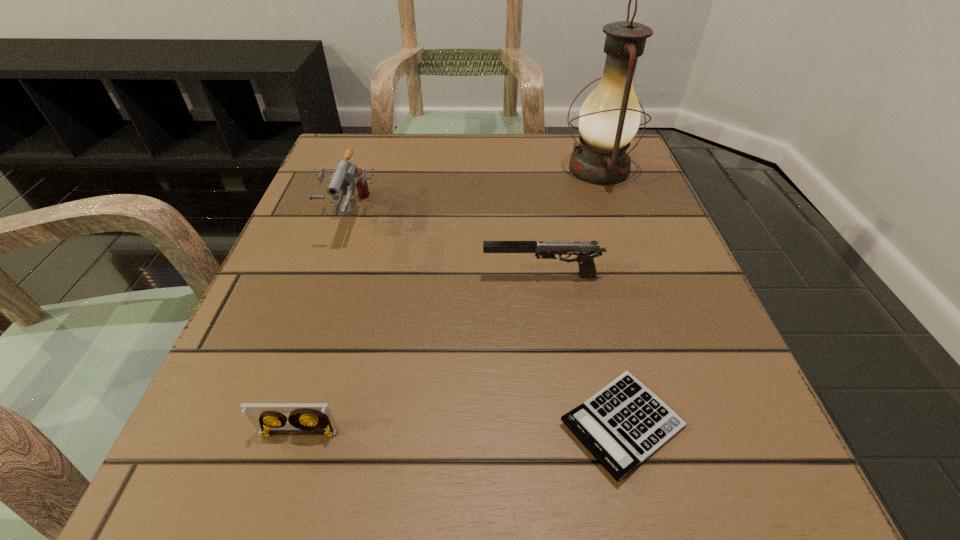
Where is `calculator situated at the right edge`? This screenshot has width=960, height=540. calculator situated at the right edge is located at coordinates (623, 424).

You are a GUI agent. You are given a task and a screenshot of the screen. Output one action in this format:
    pyautogui.click(x=<x>, y=<y>)
    Task: Click on the object at the far right corner
    This screenshot has width=960, height=540.
    Given the screenshot: What is the action you would take?
    pyautogui.click(x=609, y=118)

Where is `object at the near right corner`? This screenshot has width=960, height=540. object at the near right corner is located at coordinates (623, 424).

Image resolution: width=960 pixels, height=540 pixels. In order to click on free space at the far edge of the desktop in this screenshot , I will do `click(480, 166)`.

In the image, there is a desktop. Where is `vacant area at the near edge`? This screenshot has height=540, width=960. vacant area at the near edge is located at coordinates (437, 520).

In the image, there is a desktop. Find the location of `free space at the left edge`. free space at the left edge is located at coordinates (320, 193).

This screenshot has width=960, height=540. I want to click on free space at the right edge of the desktop, so click(x=664, y=385).

Locate an element on the screen. The height and width of the screenshot is (540, 960). free area in between the videotape and the nearer gun is located at coordinates (420, 354).

At what (x,y) coordinates should I click in order to perform the action: click on free area in between the shortest object and the left gun. Please return your answer as a coordinate pair (x, y). The height and width of the screenshot is (540, 960). Looking at the image, I should click on (486, 320).

The image size is (960, 540). I want to click on free space between the right gun and the tallest object, so click(x=570, y=222).